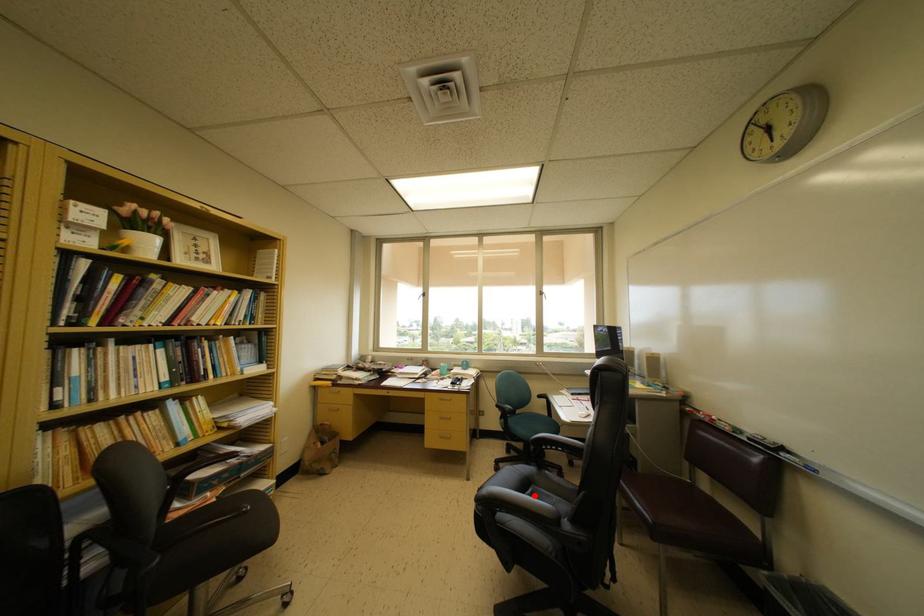
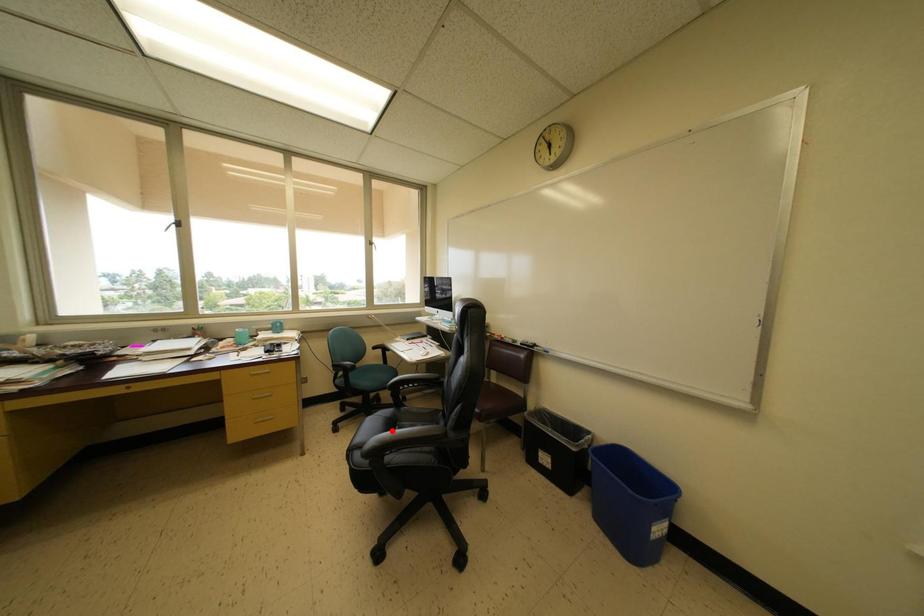
I am providing you with two images of the same scene from different viewpoints. A red point is marked on the first image and another point is marked on the second image. Are the points marked in image1 and image2 representing the same 3D position?

No